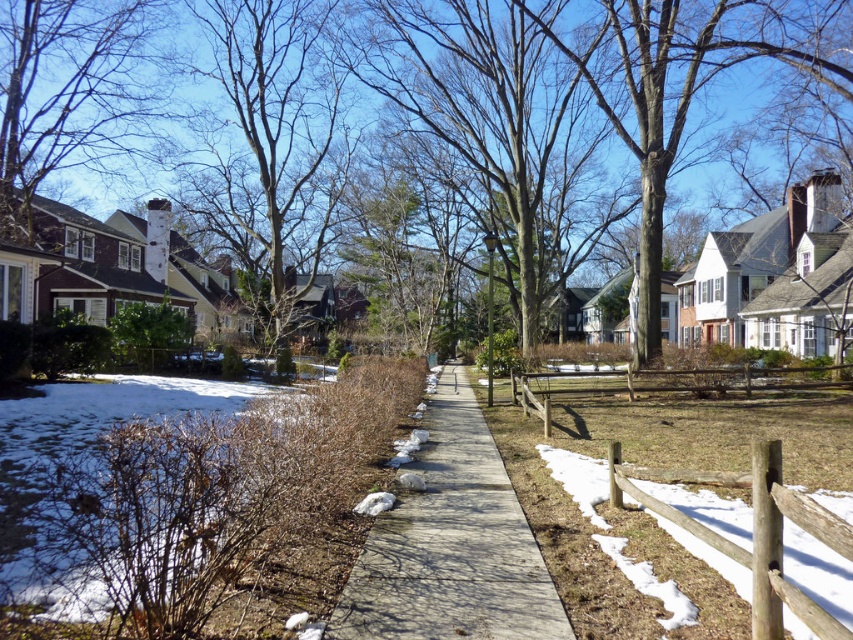
Question: Which object appears closest to the camera in this image?

Choices:
 (A) brown textured tree at upper left
 (B) smooth gray chimney at upper left

Answer: (B)

Question: Does brown textured tree at upper left have a greater width compared to brown wooden fence at center-right?

Choices:
 (A) no
 (B) yes

Answer: (B)

Question: Which object appears farthest from the camera in this image?

Choices:
 (A) smooth gray chimney at upper left
 (B) brown textured tree at upper left

Answer: (B)

Question: Which object appears closest to the camera in this image?

Choices:
 (A) brown wooden fence at lower right
 (B) brown textured tree at upper left
 (C) brown wooden fence at center-right

Answer: (A)

Question: Is concrete at center positioned behind brown wooden fence at lower right?

Choices:
 (A) yes
 (B) no

Answer: (B)

Question: Does smooth gray chimney at upper left have a larger size compared to brown wooden fence at lower right?

Choices:
 (A) yes
 (B) no

Answer: (A)